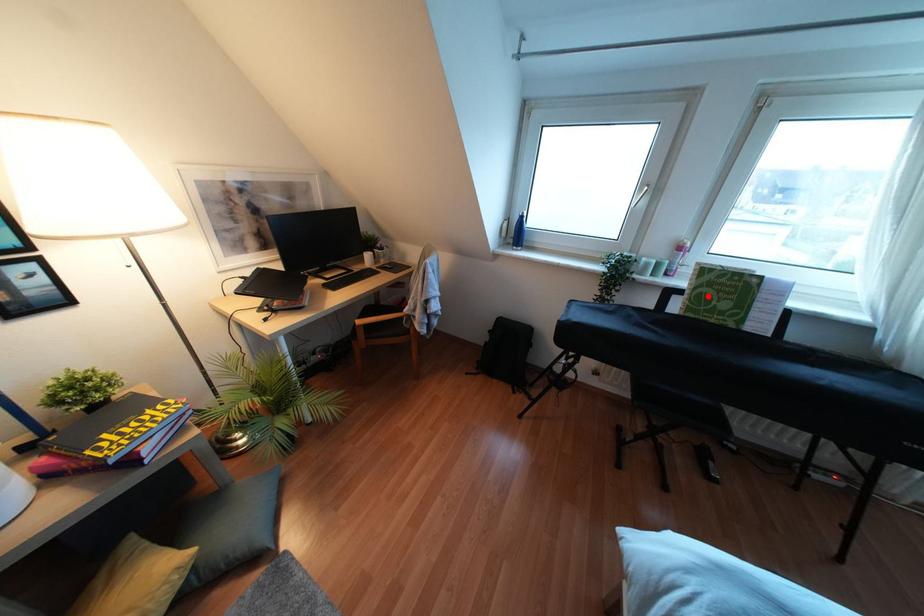
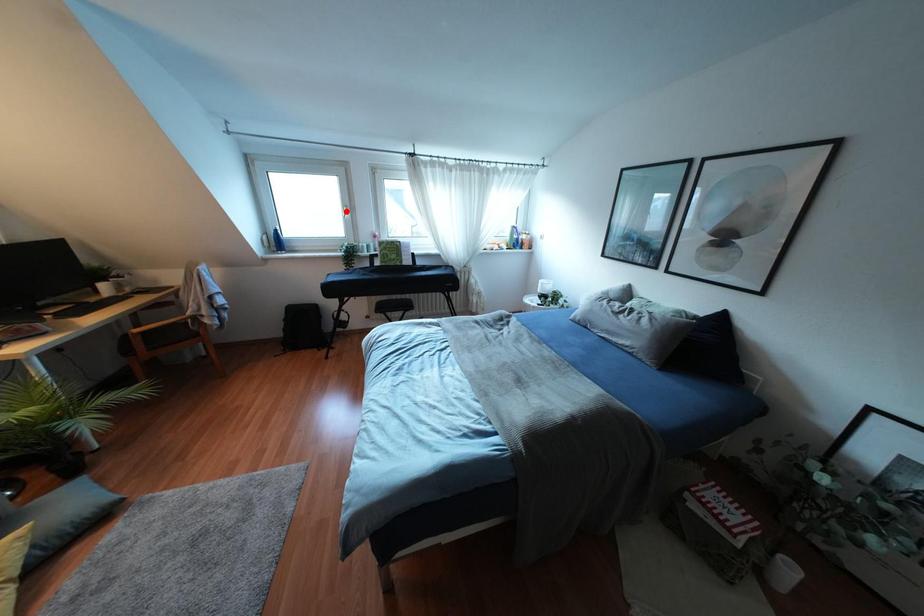
I am providing you with two images of the same scene from different viewpoints. A red point is marked on the first image and another point is marked on the second image. Does the point marked in image1 correspond to the same location as the one in image2?

No